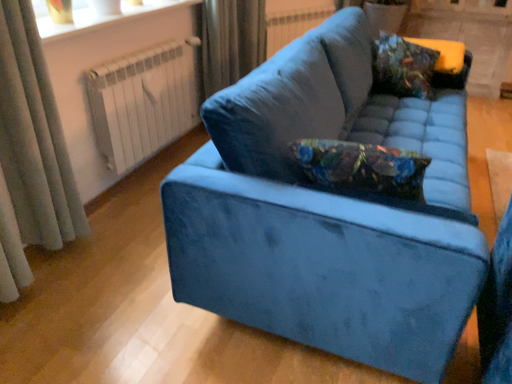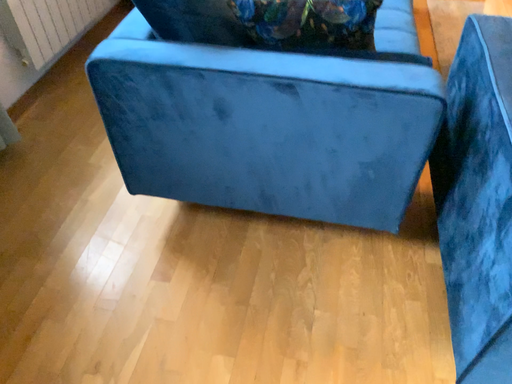
Question: Which way did the camera rotate in the video?

Choices:
 (A) rotated left
 (B) rotated right

Answer: (B)